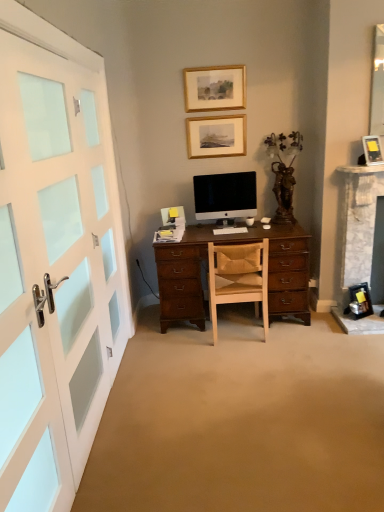
What are the coordinates of `white matte computer keyboard at center` in the screenshot? It's located at (230, 230).

What do you see at coordinates (230, 230) in the screenshot? I see `white matte computer keyboard at center` at bounding box center [230, 230].

What do you see at coordinates (54, 272) in the screenshot? The height and width of the screenshot is (512, 384). I see `white painted wood door at left` at bounding box center [54, 272].

Describe the element at coordinates (225, 196) in the screenshot. I see `satin black monitor at center` at that location.

This screenshot has height=512, width=384. What do you see at coordinates (238, 277) in the screenshot?
I see `wooden chair at center` at bounding box center [238, 277].

Where is `white matte computer keyboard at center`? The width and height of the screenshot is (384, 512). white matte computer keyboard at center is located at coordinates (230, 230).

Which is more to the right, white glossy computer mouse at center or brown wooden statue at upper right?

brown wooden statue at upper right.

Find the location of a particular element. houseplant to the right of white glossy computer mouse at center is located at coordinates (283, 175).

Between white glossy computer mouse at center and brown wooden statue at upper right, which one is positioned in front?

Positioned in front is brown wooden statue at upper right.

Is white glossy computer mouse at center aimed at brown wooden statue at upper right?

No, white glossy computer mouse at center is not turned towards brown wooden statue at upper right.

Is wooden picture frame at upper center, which is the second picture frame in bottom-to-top order, taller or shorter than white matte computer keyboard at center?

wooden picture frame at upper center, which is the second picture frame in bottom-to-top order, is taller than white matte computer keyboard at center.

From the image's perspective, which object appears higher, wooden picture frame at upper center, the 2th picture frame in the right-to-left sequence, or white matte computer keyboard at center?

wooden picture frame at upper center, the 2th picture frame in the right-to-left sequence, from the image's perspective.

Would you consider wooden picture frame at upper center, the 2th picture frame in the right-to-left sequence, to be distant from white matte computer keyboard at center?

No, wooden picture frame at upper center, the 2th picture frame in the right-to-left sequence, is in close proximity to white matte computer keyboard at center.

Is gold/glossy picture frame at upper center, positioned as the 2th picture frame in front-to-back order, located outside white matte computer keyboard at center?

Yes, gold/glossy picture frame at upper center, positioned as the 2th picture frame in front-to-back order, is located beyond the bounds of white matte computer keyboard at center.

Could you measure the distance between gold/glossy picture frame at upper center, positioned as the 2th picture frame in front-to-back order, and white matte computer keyboard at center?

A distance of 3.81 feet exists between gold/glossy picture frame at upper center, positioned as the 2th picture frame in front-to-back order, and white matte computer keyboard at center.

Does gold/glossy picture frame at upper center, positioned as the 2th picture frame in front-to-back order, come in front of white matte computer keyboard at center?

No, the depth of gold/glossy picture frame at upper center, positioned as the 2th picture frame in front-to-back order, is greater than that of white matte computer keyboard at center.

From a real-world perspective, is gold/glossy picture frame at upper center, positioned as the 2th picture frame in front-to-back order, on top of white matte computer keyboard at center?

Yes, from a real-world perspective, gold/glossy picture frame at upper center, positioned as the 2th picture frame in front-to-back order, is on top of white matte computer keyboard at center.

Is wooden picture frame at upper center, which is counted as the first picture frame, starting from the back, at the left side of wooden chair at center?

Indeed, wooden picture frame at upper center, which is counted as the first picture frame, starting from the back, is positioned on the left side of wooden chair at center.

Is the depth of wooden picture frame at upper center, the 2th picture frame in the right-to-left sequence, greater than that of wooden chair at center?

Yes, the depth of wooden picture frame at upper center, the 2th picture frame in the right-to-left sequence, is greater than that of wooden chair at center.

From a real-world perspective, who is located higher, wooden picture frame at upper center, which ranks as the second picture frame in left-to-right order, or wooden chair at center?

wooden picture frame at upper center, which ranks as the second picture frame in left-to-right order, from a real-world perspective.

Is white matte computer keyboard at center shorter than wooden chair at center?

Yes, white matte computer keyboard at center is shorter than wooden chair at center.

Can you confirm if white matte computer keyboard at center is thinner than wooden chair at center?

Yes, white matte computer keyboard at center is thinner than wooden chair at center.

Consider the image. Is white matte computer keyboard at center next to wooden chair at center?

No, white matte computer keyboard at center is not next to wooden chair at center.

What's the angular difference between white painted wood door at left and white glossy computer mouse at center's facing directions?

The angular difference between white painted wood door at left and white glossy computer mouse at center is 96.8 degrees.

Is point (26, 170) behind point (268, 227)?

No, it is not.

Between white painted wood door at left and white glossy computer mouse at center, which one has larger size?

Bigger between the two is white painted wood door at left.

Can you confirm if white painted wood door at left is shorter than white glossy computer mouse at center?

In fact, white painted wood door at left may be taller than white glossy computer mouse at center.

Is white matte computer keyboard at center positioned in front of brown wooden statue at upper right?

No.

Considering the positions of points (231, 229) and (277, 191), is point (231, 229) farther from camera compared to point (277, 191)?

No.

Could you tell me if white matte computer keyboard at center is facing brown wooden statue at upper right?

No, white matte computer keyboard at center does not turn towards brown wooden statue at upper right.

How far apart are white matte computer keyboard at center and brown wooden statue at upper right?

white matte computer keyboard at center and brown wooden statue at upper right are 24.93 inches apart.

This screenshot has width=384, height=512. Find the location of `houseplant on the right of white glossy computer mouse at center`. houseplant on the right of white glossy computer mouse at center is located at coordinates (283, 175).

What are the coordinates of `computer keyboard that is in front of the wooden picture frame at upper center, the 2th picture frame in the right-to-left sequence` in the screenshot? It's located at (230, 230).

Estimate the real-world distances between objects in this image. Which object is further from white painted wood door at left, satin black monitor at center or wooden picture frame at upper center, the 2th picture frame in the right-to-left sequence?

Based on the image, wooden picture frame at upper center, the 2th picture frame in the right-to-left sequence, appears to be further to white painted wood door at left.

When comparing their distances from wooden picture frame at upper center, the third picture frame in the front-to-back sequence, does white matte computer keyboard at center or white painted wood door at left seem further?

Based on the image, white painted wood door at left appears to be further to wooden picture frame at upper center, the third picture frame in the front-to-back sequence.

From the image, which object appears to be farther from white glossy computer mouse at center, wooden chair at center or white matte computer keyboard at center?

wooden chair at center lies further to white glossy computer mouse at center than the other object.

From the image, which object appears to be nearer to white painted wood door at left, white matte computer keyboard at center or wooden chair at center?

The object closer to white painted wood door at left is wooden chair at center.

When comparing their distances from gold/glossy picture frame at upper center, arranged as the 3th picture frame when viewed from the right, does wooden chair at center or white matte computer keyboard at center seem closer?

white matte computer keyboard at center is positioned closer to the anchor gold/glossy picture frame at upper center, arranged as the 3th picture frame when viewed from the right.

Which object lies further to the anchor point wooden chair at center, satin black monitor at center or white glossy computer mouse at center?

Among the two, satin black monitor at center is located further to wooden chair at center.

Based on their spatial positions, is white matte computer keyboard at center or wooden chair at center closer to gold/glossy picture frame at upper center, arranged as the 3th picture frame when ordered from the bottom?

white matte computer keyboard at center.

Looking at the image, which one is located closer to wooden picture frame at upper center, which ranks as the second picture frame in left-to-right order, white glossy computer mouse at center or white painted wood door at left?

The object closer to wooden picture frame at upper center, which ranks as the second picture frame in left-to-right order, is white glossy computer mouse at center.

Find the location of `houseplant situated between satin black monitor at center and matte black picture frame at upper right, which appears as the third picture frame when viewed from the top, from left to right`. houseplant situated between satin black monitor at center and matte black picture frame at upper right, which appears as the third picture frame when viewed from the top, from left to right is located at coordinates (283, 175).

In order to click on houseplant between matte black picture frame at upper right, which is the 3th picture frame in back-to-front order, and wooden chair at center in the up-down direction in this screenshot , I will do tap(283, 175).

At what (x,y) coordinates should I click in order to perform the action: click on computer keyboard between gold/glossy picture frame at upper center, positioned as the second picture frame in back-to-front order, and matte black picture frame at upper right, which appears as the third picture frame when viewed from the top, from left to right. Please return your answer as a coordinate pair (x, y). Looking at the image, I should click on (230, 230).

At what (x,y) coordinates should I click in order to perform the action: click on picture frame situated between gold/glossy picture frame at upper center, arranged as the 3th picture frame when viewed from the right, and matte black picture frame at upper right, which is counted as the 3th picture frame, starting from the left, from left to right. Please return your answer as a coordinate pair (x, y). This screenshot has height=512, width=384. Looking at the image, I should click on [216, 136].